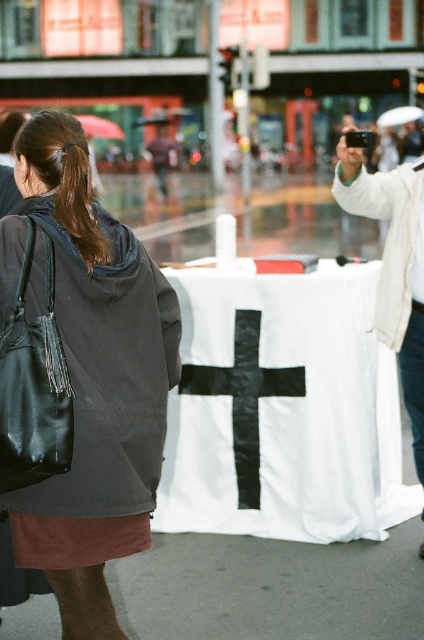
Question: Which object is closer to the camera taking this photo?

Choices:
 (A) white matte phone at upper right
 (B) brown shiny hair at left
 (C) black leather jacket at left

Answer: (C)

Question: Can you confirm if white matte phone at upper right is wider than brown shiny hair at left?

Choices:
 (A) yes
 (B) no

Answer: (A)

Question: Which object is farther from the camera taking this photo?

Choices:
 (A) brown shiny hair at left
 (B) black leather jacket at left
 (C) white matte phone at upper right

Answer: (C)

Question: Is the position of black leather jacket at left less distant than that of brown shiny hair at left?

Choices:
 (A) yes
 (B) no

Answer: (A)

Question: Is white matte phone at upper right positioned behind brown shiny hair at left?

Choices:
 (A) no
 (B) yes

Answer: (B)

Question: Among these objects, which one is farthest from the camera?

Choices:
 (A) white matte phone at upper right
 (B) black leather jacket at left
 (C) brown shiny hair at left

Answer: (A)